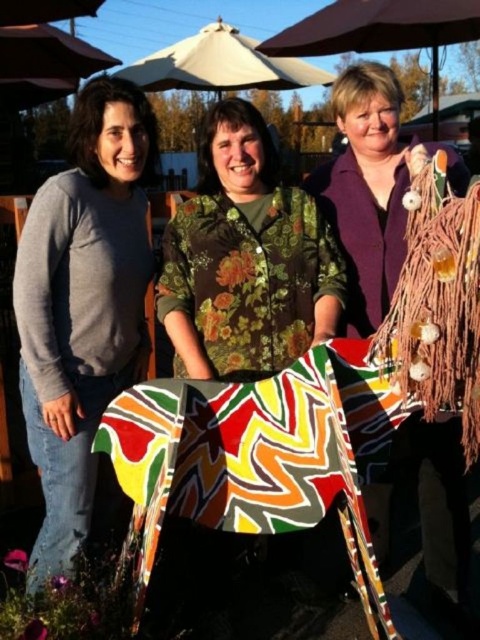
Question: Which point is closer to the camera taking this photo?

Choices:
 (A) (464, 531)
 (B) (37, 554)

Answer: (B)

Question: Is matte gray sweater at left smaller than floral fabric shirt at center?

Choices:
 (A) yes
 (B) no

Answer: (B)

Question: Which object is farther from the camera taking this photo?

Choices:
 (A) matte gray sweater at left
 (B) floral fabric shirt at center
 (C) matte white umbrella at upper center
 (D) purple woolen sweater at center

Answer: (C)

Question: Considering the relative positions of purple woolen sweater at center and matte white umbrella at upper center in the image provided, where is purple woolen sweater at center located with respect to matte white umbrella at upper center?

Choices:
 (A) below
 (B) above

Answer: (A)

Question: Does floral fabric shirt at center appear under beige fabric umbrella at upper center?

Choices:
 (A) no
 (B) yes

Answer: (B)

Question: Considering the real-world distances, which object is farthest from the floral fabric shirt at center?

Choices:
 (A) matte gray sweater at left
 (B) matte white umbrella at upper center
 (C) beige fabric umbrella at upper center

Answer: (C)